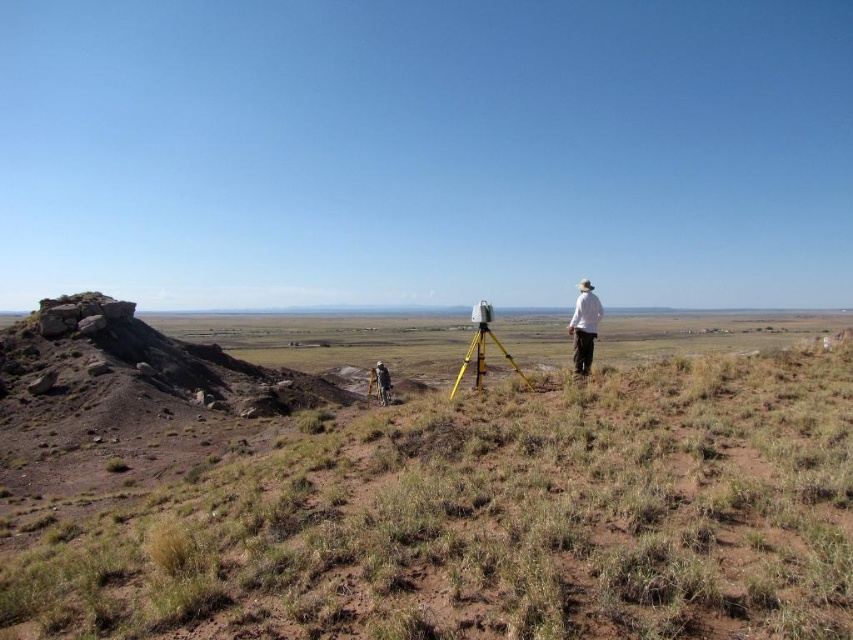
You are a hiker trying to navigate through the dry grass at center and the white matte shirt at right. Which object is closer to your current position?

The dry grass at center is closer to your current position because it is in front of the white matte shirt at right.

You are a photographer planning to take a photo of the point at coordinate (257,493) from the camera position. The camera is set to a focal length of 50mm. If the point is 47.91 feet away, what is the approximate angle of view required to capture the point in the frame?

The angle of view required to capture the point at coordinate (257,493) would depend on the camera sensor size and the focal length. However, with a 50mm lens on a full frame sensor, the diagonal angle of view is approximately 46 degrees. Since the point is 47.91 feet away, this angle should suffice to include the point in the frame.